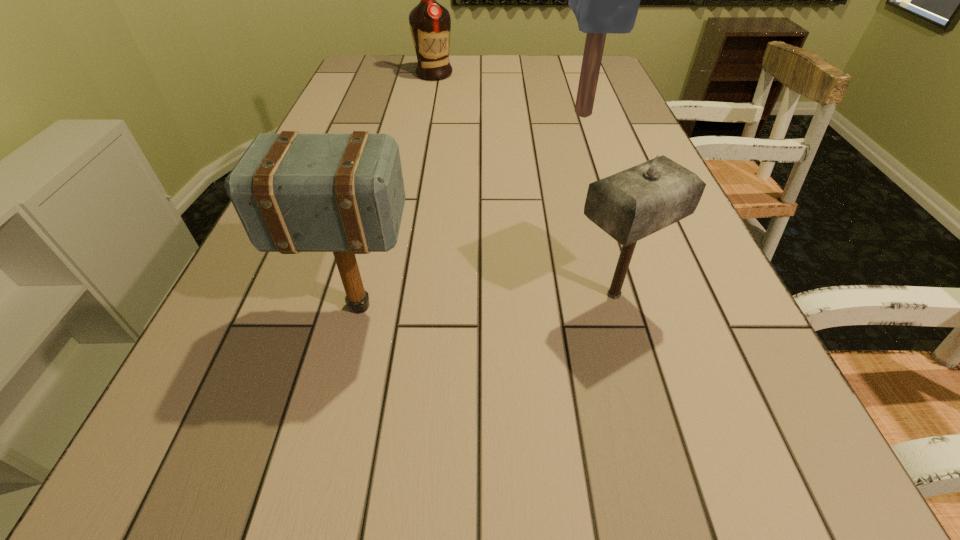
You are a GUI agent. You are given a task and a screenshot of the screen. Output one action in this format:
    pyautogui.click(x=<x>, y=<y>)
    Task: Click on the free space that satisfies the following two spatial constraints: 1. on the front and back of the farthest object; 2. on the striking surface of the leftmost mallet
    The width and height of the screenshot is (960, 540).
    Given the screenshot: What is the action you would take?
    pyautogui.click(x=392, y=306)

The image size is (960, 540). I want to click on vacant space that satisfies the following two spatial constraints: 1. on the front and back of the liquor; 2. on the striking surface of the leftmost mallet, so pyautogui.click(x=392, y=306).